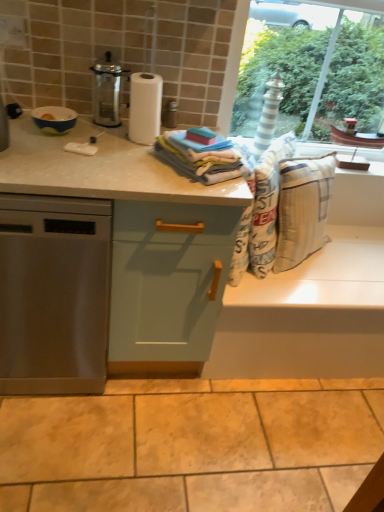
Describe the element at coordinates (54, 119) in the screenshot. Image resolution: width=384 pixels, height=512 pixels. I see `matte ceramic bowl at upper left` at that location.

The height and width of the screenshot is (512, 384). What are the coordinates of `soft cotton towels at center` in the screenshot? It's located at (202, 157).

What is the approximate width of light green wood cabinet at center?

The width of light green wood cabinet at center is 24.03 inches.

What do you see at coordinates (192, 446) in the screenshot? I see `beige marble granite at lower center` at bounding box center [192, 446].

Image resolution: width=384 pixels, height=512 pixels. I want to click on metallic glass carafe at upper left, so 107,91.

Measure the distance between soft cotton towels at center and beige marble granite at lower center.

A distance of 38.55 inches exists between soft cotton towels at center and beige marble granite at lower center.

Locate an element on the screen. blanket that is on the left side of beige marble granite at lower center is located at coordinates (202, 157).

Between soft cotton towels at center and beige marble granite at lower center, which one appears on the left side from the viewer's perspective?

soft cotton towels at center.

Consider the image. Do you think soft cotton towels at center is within beige marble granite at lower center, or outside of it?

soft cotton towels at center is outside beige marble granite at lower center.

Is metallic glass carafe at upper left positioned beyond the bounds of soft cotton towels at center?

Indeed, metallic glass carafe at upper left is completely outside soft cotton towels at center.

How many degrees apart are the facing directions of metallic glass carafe at upper left and soft cotton towels at center?

The angle between the facing direction of metallic glass carafe at upper left and the facing direction of soft cotton towels at center is 58.5 degrees.

Is metallic glass carafe at upper left positioned behind soft cotton towels at center?

Yes.

Does metallic glass carafe at upper left have a greater height compared to soft cotton towels at center?

Yes.

From the image's perspective, is light green wood cabinet at center over stainless steel dishwasher at left?

No, from the image's perspective, light green wood cabinet at center is not over stainless steel dishwasher at left.

Is there a large distance between light green wood cabinet at center and stainless steel dishwasher at left?

No.

Which object is positioned more to the left, beige marble granite at lower center or matte ceramic bowl at upper left?

matte ceramic bowl at upper left.

From a real-world perspective, which is physically below, beige marble granite at lower center or matte ceramic bowl at upper left?

beige marble granite at lower center is physically lower.

Considering the sizes of objects beige marble granite at lower center and matte ceramic bowl at upper left in the image provided, who is wider, beige marble granite at lower center or matte ceramic bowl at upper left?

With larger width is beige marble granite at lower center.

Is matte ceramic bowl at upper left next to light green wood cabinet at center and touching it?

No, matte ceramic bowl at upper left is not in contact with light green wood cabinet at center.

From a real-world perspective, is matte ceramic bowl at upper left above or below light green wood cabinet at center?

From a real-world perspective, matte ceramic bowl at upper left is physically above light green wood cabinet at center.

In terms of height, does matte ceramic bowl at upper left look taller or shorter compared to light green wood cabinet at center?

matte ceramic bowl at upper left is shorter than light green wood cabinet at center.

The height and width of the screenshot is (512, 384). Find the location of `appliance on the left of beige cotton laundry at center`. appliance on the left of beige cotton laundry at center is located at coordinates (54, 119).

Considering the positions of objects beige cotton laundry at center and matte ceramic bowl at upper left in the image provided, who is more to the right, beige cotton laundry at center or matte ceramic bowl at upper left?

From the viewer's perspective, beige cotton laundry at center appears more on the right side.

Choose the correct answer: Is beige cotton laundry at center inside matte ceramic bowl at upper left or outside it?

beige cotton laundry at center cannot be found inside matte ceramic bowl at upper left.

Which is closer to the camera, (189, 172) or (62, 269)?

Point (189, 172).

Is soft cotton towels at center looking in the opposite direction of stainless steel dishwasher at left?

No, soft cotton towels at center's orientation is not away from stainless steel dishwasher at left.

Which is more to the right, soft cotton towels at center or stainless steel dishwasher at left?

Positioned to the right is soft cotton towels at center.

This screenshot has width=384, height=512. Find the location of `granite below the soft cotton towels at center (from the image's perspective)`. granite below the soft cotton towels at center (from the image's perspective) is located at coordinates (192, 446).

Image resolution: width=384 pixels, height=512 pixels. In order to click on blanket on the right of metallic glass carafe at upper left in this screenshot , I will do `click(202, 157)`.

Considering their positions, is beige marble granite at lower center positioned closer to soft cotton towels at center than stainless steel dishwasher at left?

stainless steel dishwasher at left is closer to soft cotton towels at center.

Considering their positions, is beige marble granite at lower center positioned closer to light green wood cabinet at center than metallic glass carafe at upper left?

beige marble granite at lower center.

Estimate the real-world distances between objects in this image. Which object is closer to beige cotton laundry at center, light green wood cabinet at center or stainless steel dishwasher at left?

light green wood cabinet at center lies closer to beige cotton laundry at center than the other object.

Consider the image. Which object lies further to the anchor point soft cotton towels at center, beige cotton laundry at center or light green wood cabinet at center?

light green wood cabinet at center lies further to soft cotton towels at center than the other object.

Looking at the image, which one is located further to stainless steel dishwasher at left, matte ceramic bowl at upper left or beige cotton laundry at center?

beige cotton laundry at center.

Based on their spatial positions, is metallic glass carafe at upper left or matte ceramic bowl at upper left further from beige marble granite at lower center?

metallic glass carafe at upper left is further to beige marble granite at lower center.

Looking at the image, which one is located further to soft cotton towels at center, metallic glass carafe at upper left or beige cotton laundry at center?

Based on the image, metallic glass carafe at upper left appears to be further to soft cotton towels at center.

Looking at this image, from the image, which object appears to be farther from matte ceramic bowl at upper left, soft cotton towels at center or metallic glass carafe at upper left?

soft cotton towels at center is positioned further to the anchor matte ceramic bowl at upper left.

Where is `cabinetry between stainless steel dishwasher at left and beige marble granite at lower center from top to bottom`? The height and width of the screenshot is (512, 384). cabinetry between stainless steel dishwasher at left and beige marble granite at lower center from top to bottom is located at coordinates (167, 285).

Identify the location of cabinetry located between stainless steel dishwasher at left and soft cotton towels at center in the left-right direction. (167, 285).

Where is `kitchen appliance between matte ceramic bowl at upper left and soft cotton towels at center`? The image size is (384, 512). kitchen appliance between matte ceramic bowl at upper left and soft cotton towels at center is located at coordinates (107, 91).

This screenshot has width=384, height=512. In order to click on blanket between metallic glass carafe at upper left and beige cotton laundry at center in this screenshot , I will do `click(202, 157)`.